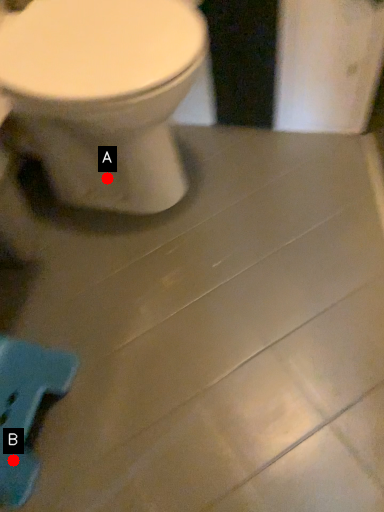
Question: Two points are circled on the image, labeled by A and B beside each circle. Which point is farther to the camera?

Choices:
 (A) A is further
 (B) B is further

Answer: (A)